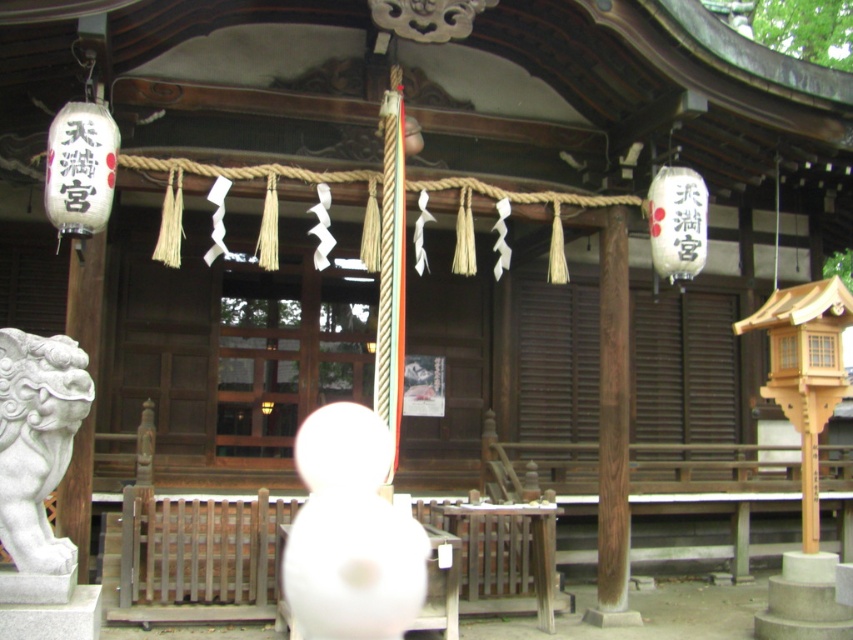
In the scene shown: Does white stone lion at left appear on the right side of white paper lantern at upper right?

In fact, white stone lion at left is to the left of white paper lantern at upper right.

Is white stone lion at left closer to the viewer compared to white paper lantern at upper right?

Yes, it is.

Where is `white stone lion at left`? Image resolution: width=853 pixels, height=640 pixels. white stone lion at left is located at coordinates (38, 444).

At what (x,y) coordinates should I click in order to perform the action: click on white stone lion at left. Please return your answer as a coordinate pair (x, y). The image size is (853, 640). Looking at the image, I should click on (38, 444).

Is white paper lantern at left above white paper lantern at upper right?

Correct, white paper lantern at left is located above white paper lantern at upper right.

You are a GUI agent. You are given a task and a screenshot of the screen. Output one action in this format:
    pyautogui.click(x=<x>, y=<y>)
    Task: Click on the white paper lantern at left
    
    Given the screenshot: What is the action you would take?
    pyautogui.click(x=80, y=170)

Describe the element at coordinates (80, 170) in the screenshot. This screenshot has height=640, width=853. I see `white paper lantern at left` at that location.

Where is `white paper lantern at left`? white paper lantern at left is located at coordinates (80, 170).

Does white stone lion at left appear under white paper lantern at left?

Yes, white stone lion at left is below white paper lantern at left.

Is point (20, 358) positioned in front of point (62, 150)?

Yes.

Where is `white stone lion at left`? This screenshot has width=853, height=640. white stone lion at left is located at coordinates (38, 444).